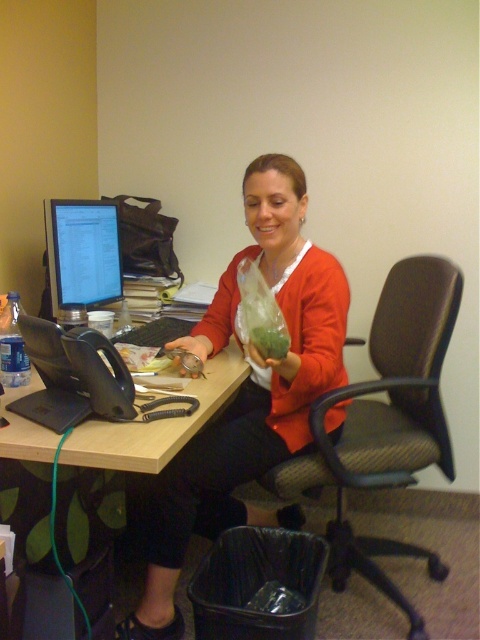
Question: Among these objects, which one is farthest from the camera?

Choices:
 (A) matte red sweater at center
 (B) matte black monitor at left

Answer: (B)

Question: Which of the following is the farthest from the observer?

Choices:
 (A) matte red sweater at center
 (B) wooden desk at center
 (C) brown fabric swivel chair at center

Answer: (C)

Question: Which of the following is the farthest from the observer?

Choices:
 (A) wooden desk at center
 (B) brown fabric swivel chair at center
 (C) matte red sweater at center
 (D) matte black monitor at left

Answer: (D)

Question: Can you confirm if wooden desk at center is positioned below matte black monitor at left?

Choices:
 (A) yes
 (B) no

Answer: (A)

Question: Can you confirm if wooden desk at center is smaller than matte black monitor at left?

Choices:
 (A) no
 (B) yes

Answer: (A)

Question: Can you confirm if brown fabric swivel chair at center is thinner than wooden desk at center?

Choices:
 (A) yes
 (B) no

Answer: (A)